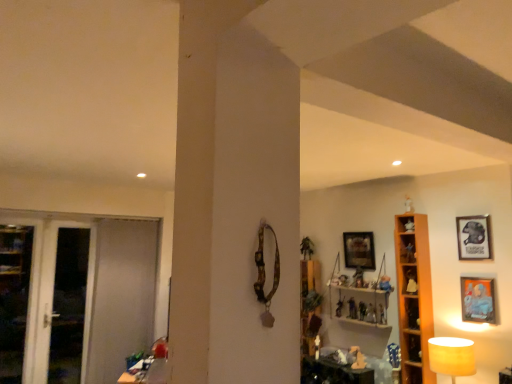
Question: Is wooden cabinet at left, marked as the second cabinet in a front-to-back arrangement, wider than matte wooden picture frame at right, the second picture frame viewed from the left?

Choices:
 (A) yes
 (B) no

Answer: (A)

Question: Is wooden cabinet at left, the 1th cabinet in the left-to-right sequence, looking in the opposite direction of matte wooden picture frame at right, the third picture frame in the back-to-front sequence?

Choices:
 (A) yes
 (B) no

Answer: (B)

Question: From the image's perspective, is wooden cabinet at left, which is counted as the 1th cabinet, starting from the bottom, beneath matte wooden picture frame at right, the first picture frame in the front-to-back sequence?

Choices:
 (A) no
 (B) yes

Answer: (B)

Question: Could you tell me if wooden cabinet at left, the 2th cabinet viewed from the top, is turned towards matte wooden picture frame at right, positioned as the second picture frame in right-to-left order?

Choices:
 (A) yes
 (B) no

Answer: (B)

Question: From the image's perspective, is wooden cabinet at left, the 2th cabinet viewed from the top, located above matte wooden picture frame at right, positioned as the second picture frame in right-to-left order?

Choices:
 (A) yes
 (B) no

Answer: (B)

Question: Is point [370, 312] closer or farther from the camera than point [362, 302]?

Choices:
 (A) farther
 (B) closer

Answer: (B)

Question: Considering the positions of translucent plastic figurine at center-right, which ranks as the 4th toy in bottom-to-top order, and matte plastic toy at center, which is counted as the 4th toy, starting from the front, in the image, is translucent plastic figurine at center-right, which ranks as the 4th toy in bottom-to-top order, taller or shorter than matte plastic toy at center, which is counted as the 4th toy, starting from the front,?

Choices:
 (A) short
 (B) tall

Answer: (A)

Question: Would you say translucent plastic figurine at center-right, placed as the third toy when sorted from front to back, is inside or outside matte plastic toy at center, the 3th toy when ordered from left to right?

Choices:
 (A) outside
 (B) inside

Answer: (A)

Question: Is translucent plastic figurine at center-right, the third toy from the right, wider or thinner than matte plastic toy at center, arranged as the fourth toy when viewed from the right?

Choices:
 (A) wide
 (B) thin

Answer: (B)

Question: In the image, is translucent plastic figurine at center-right, the fourth toy in the back-to-front sequence, positioned in front of or behind metallic silver picture frame at upper right, which is the first picture frame from right to left?

Choices:
 (A) front
 (B) behind

Answer: (B)

Question: Which is correct: translucent plastic figurine at center-right, acting as the 4th toy starting from the left, is inside metallic silver picture frame at upper right, the second picture frame in the back-to-front sequence, or outside of it?

Choices:
 (A) outside
 (B) inside

Answer: (A)

Question: From a real-world perspective, is translucent plastic figurine at center-right, placed as the third toy when sorted from front to back, positioned above or below metallic silver picture frame at upper right, acting as the 2th picture frame starting from the front?

Choices:
 (A) below
 (B) above

Answer: (A)

Question: Is point (374, 319) closer or farther from the camera than point (480, 221)?

Choices:
 (A) closer
 (B) farther

Answer: (B)

Question: From a real-world perspective, is white glossy screen door at left, the 1th screen door viewed from the left, positioned above or below matte plastic toy at center, the second toy in the front-to-back sequence?

Choices:
 (A) above
 (B) below

Answer: (B)

Question: Based on their sizes in the image, would you say white glossy screen door at left, the 1th screen door viewed from the left, is bigger or smaller than matte plastic toy at center, positioned as the 5th toy in left-to-right order?

Choices:
 (A) small
 (B) big

Answer: (B)